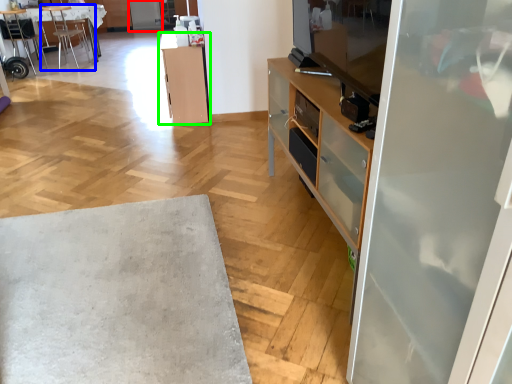
Question: Which object is positioned farthest from screen door (highlighted by a red box)? Select from chair (highlighted by a blue box) and cabinetry (highlighted by a green box).

Choices:
 (A) chair
 (B) cabinetry

Answer: (B)